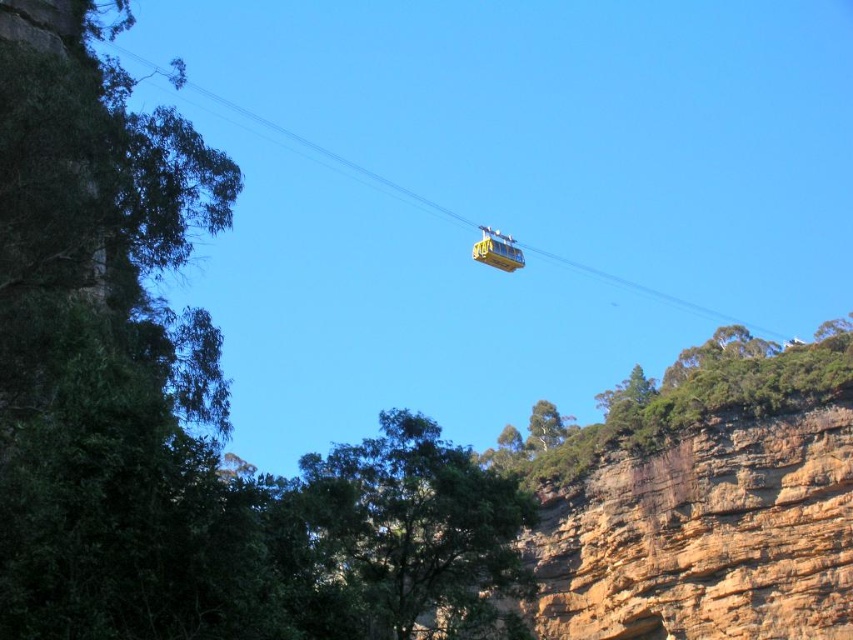
You are a photographer standing in the scenic cable car scene. You want to take a photo that includes both the brown rocky cliff at lower right and the green rough rock at upper right. Which of these two objects will appear larger in your photo?

The brown rocky cliff at lower right will appear larger in the photo because it is closer to the viewer than the green rough rock at upper right.

You are a photographer planning to capture the brown rocky cliff at lower right and the yellow matte cable car at upper center in a single shot. Based on their sizes in the image, which object should you focus on if you want to emphasize the scale of the cliff compared to the cable car?

The brown rocky cliff at lower right is bigger than the yellow matte cable car at upper center, so focusing on the cliff would emphasize its larger scale in the photo.

You are a photographer planning to capture the brown rocky cliff at lower right and the green rough rock at upper right in a single frame. Based on their spatial relationship, which of these two objects will appear smaller in the photo?

The brown rocky cliff at lower right occupies less space in the image compared to the green rough rock at upper right, so it will appear smaller in the photo.